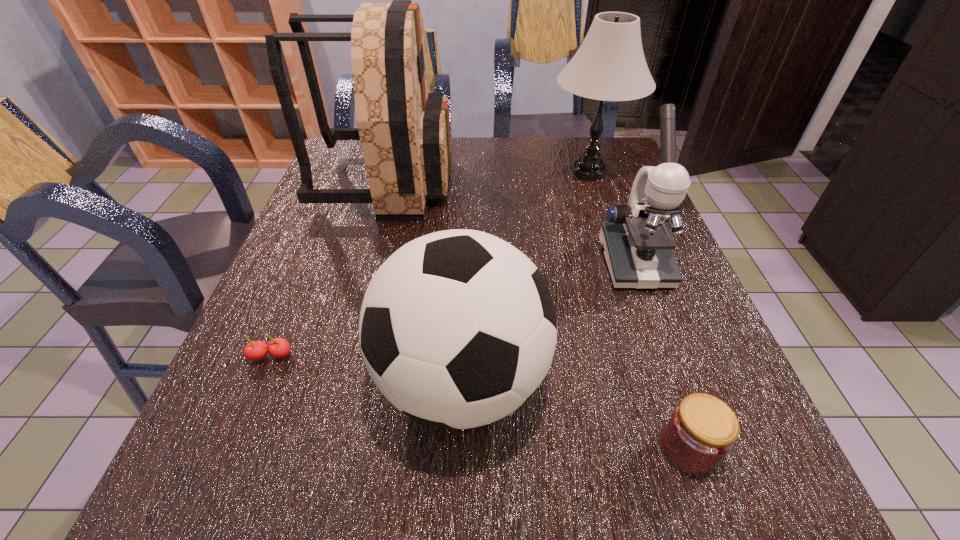
In order to click on backpack in this screenshot , I will do `click(404, 130)`.

Where is `lamp`? Image resolution: width=960 pixels, height=540 pixels. lamp is located at coordinates (610, 65).

I want to click on microscope, so click(637, 244).

Find the location of a particular element. This screenshot has height=540, width=960. soccer ball is located at coordinates (458, 328).

The image size is (960, 540). Identify the location of the second shortest object. (701, 431).

This screenshot has height=540, width=960. I want to click on cherry, so click(279, 347).

You are a GUI agent. You are given a task and a screenshot of the screen. Output one action in this format:
    pyautogui.click(x=<x>, y=<y>)
    Task: Click on the vacant position located 0.360m on the front face of the backpack
    Image resolution: width=960 pixels, height=540 pixels.
    Given the screenshot: What is the action you would take?
    pyautogui.click(x=580, y=183)

Locate an element on the screen. vacant space located on the front of the lamp is located at coordinates (617, 257).

Locate an element on the screen. The height and width of the screenshot is (540, 960). free space located on the left of the microscope is located at coordinates (426, 262).

Locate an element on the screen. vacant space located on the right of the soccer ball is located at coordinates (723, 381).